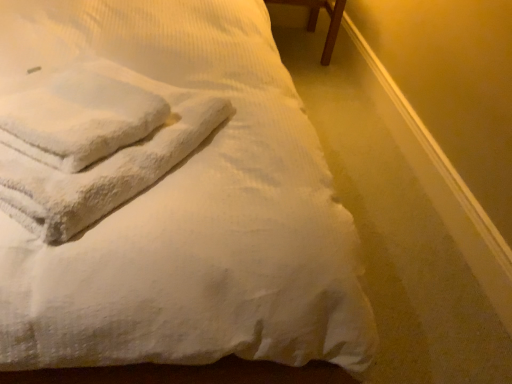
Question: Would you say brown wooden table at upper right is outside white fluffy towel at upper left, positioned as the 2th bath towel in left-to-right order?

Choices:
 (A) yes
 (B) no

Answer: (A)

Question: Considering the relative positions of brown wooden table at upper right and white fluffy towel at upper left, the first bath towel positioned from the right, in the image provided, is brown wooden table at upper right to the right of white fluffy towel at upper left, the first bath towel positioned from the right, from the viewer's perspective?

Choices:
 (A) yes
 (B) no

Answer: (A)

Question: From a real-world perspective, is brown wooden table at upper right located beneath white fluffy towel at upper left, the first bath towel positioned from the right?

Choices:
 (A) yes
 (B) no

Answer: (A)

Question: Is the depth of brown wooden table at upper right less than that of white fluffy towel at upper left, positioned as the 2th bath towel in left-to-right order?

Choices:
 (A) yes
 (B) no

Answer: (B)

Question: Is brown wooden table at upper right thinner than white fluffy towel at upper left, positioned as the 2th bath towel in left-to-right order?

Choices:
 (A) yes
 (B) no

Answer: (B)

Question: From a real-world perspective, is brown wooden table at upper right positioned over white fluffy towel at upper left, the first bath towel positioned from the right, based on gravity?

Choices:
 (A) no
 (B) yes

Answer: (A)

Question: From the image's perspective, is white fluffy towel at upper left, positioned as the 2th bath towel in left-to-right order, above white soft towel at upper left?

Choices:
 (A) no
 (B) yes

Answer: (A)

Question: Does white fluffy towel at upper left, the first bath towel positioned from the right, have a greater height compared to white soft towel at upper left?

Choices:
 (A) yes
 (B) no

Answer: (B)

Question: From the image's perspective, would you say white fluffy towel at upper left, positioned as the 2th bath towel in left-to-right order, is shown under white soft towel at upper left?

Choices:
 (A) yes
 (B) no

Answer: (A)

Question: Is white soft towel at upper left located within white fluffy towel at upper left, positioned as the 2th bath towel in left-to-right order?

Choices:
 (A) yes
 (B) no

Answer: (B)

Question: Are white fluffy towel at upper left, the first bath towel positioned from the right, and white soft towel at upper left making contact?

Choices:
 (A) no
 (B) yes

Answer: (A)

Question: Are white fluffy towel at upper left, the first bath towel positioned from the right, and white soft towel at upper left far apart?

Choices:
 (A) yes
 (B) no

Answer: (B)

Question: Considering the relative sizes of white soft towel at upper left and brown wooden table at upper right in the image provided, is white soft towel at upper left smaller than brown wooden table at upper right?

Choices:
 (A) no
 (B) yes

Answer: (A)